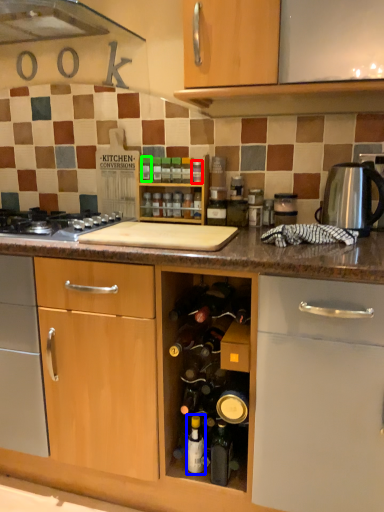
Question: Considering the real-world distances, which object is farthest from bottle (highlighted by a red box)? bottle (highlighted by a blue box) or bottle (highlighted by a green box)?

Choices:
 (A) bottle
 (B) bottle

Answer: (A)